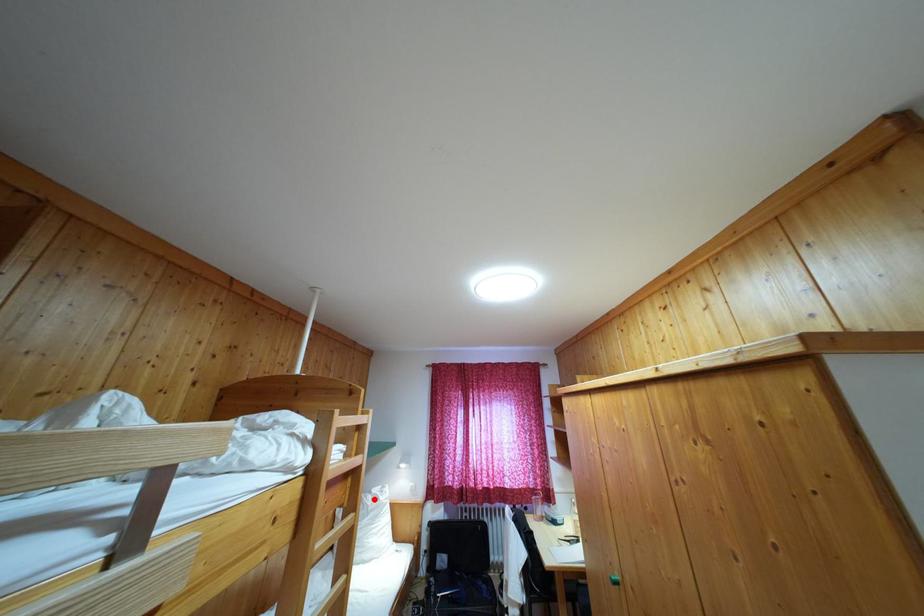
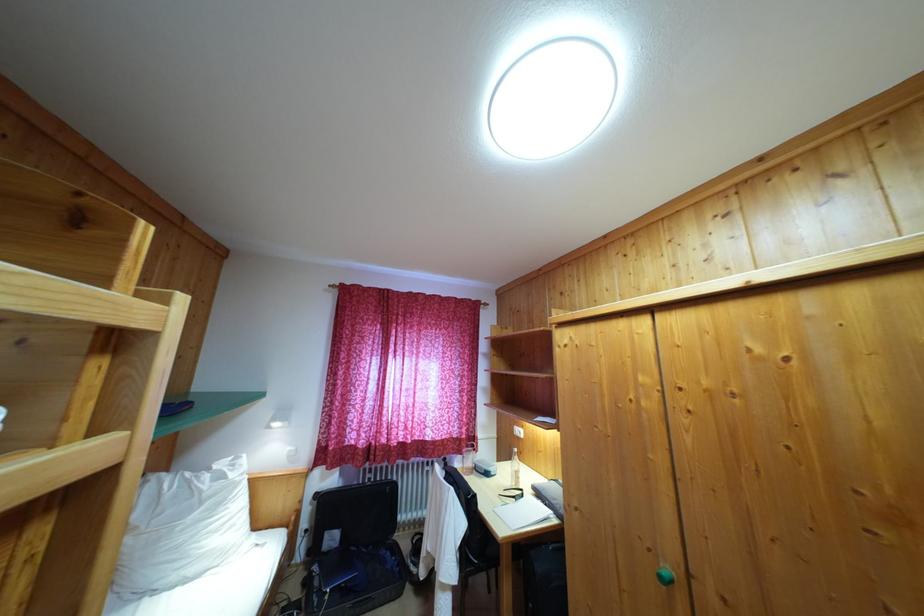
Question: I am providing you with two images of the same scene from different viewpoints. In image1, a red point is highlighted. Considering the same 3D point in image2, which of the following is correct?

Choices:
 (A) It is closer
 (B) It is farther

Answer: (A)